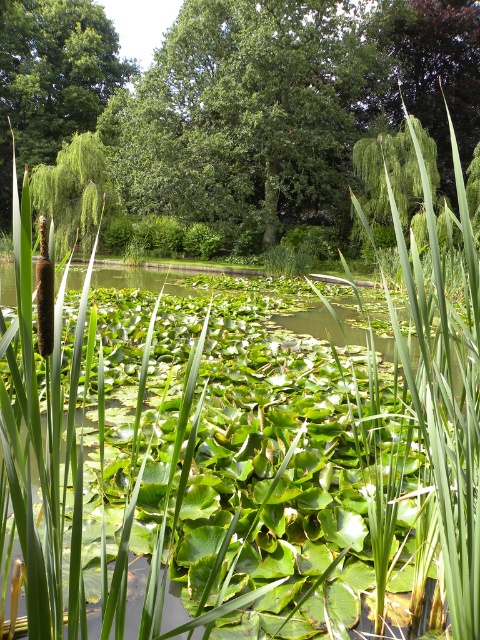
Can you confirm if green leafy tree at center is taller than green leafy tree at left?

No.

Between green leafy tree at center and green leafy tree at left, which one appears on the left side from the viewer's perspective?

From the viewer's perspective, green leafy tree at left appears more on the left side.

Which is in front, point (165, 154) or point (20, 1)?

Point (165, 154) is more forward.

At what (x,y) coordinates should I click in order to perform the action: click on green leafy tree at center. Please return your answer as a coordinate pair (x, y). The width and height of the screenshot is (480, 640). Looking at the image, I should click on (251, 115).